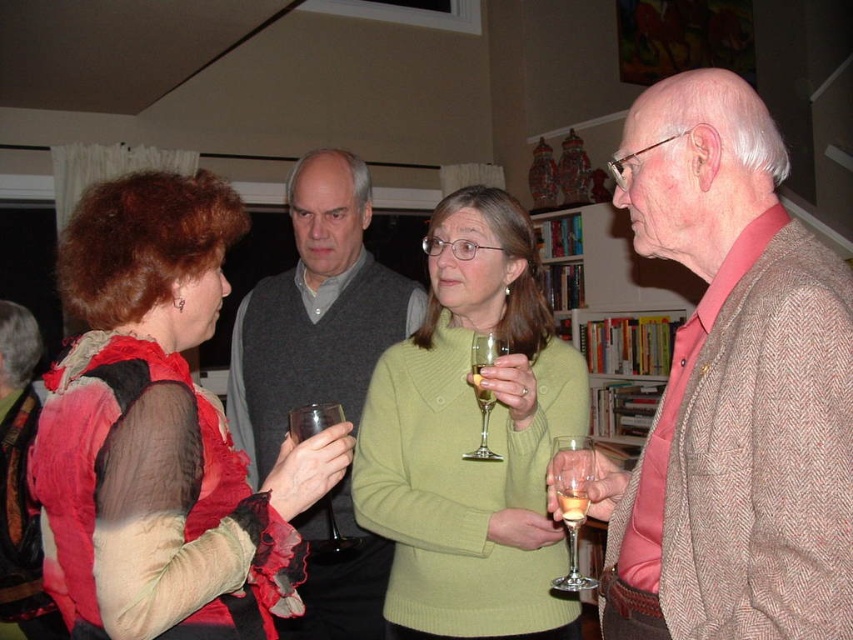
Question: Is dark gray sweater at center bigger than translucent glass wine at center?

Choices:
 (A) yes
 (B) no

Answer: (A)

Question: Which object is closer to the camera taking this photo?

Choices:
 (A) brown herringbone blazer at center
 (B) clear glass wine glass at lower right
 (C) clear glass wine glass at center
 (D) translucent glass wine at center

Answer: (A)

Question: Which object appears closest to the camera in this image?

Choices:
 (A) wooden bookshelf at center
 (B) translucent glass wine at center
 (C) translucent glass at center

Answer: (C)

Question: Can you confirm if wooden bookshelf at center is bigger than clear glass wine glass at lower right?

Choices:
 (A) no
 (B) yes

Answer: (B)

Question: Is matte red blouse at left thinner than dark gray sweater at center?

Choices:
 (A) yes
 (B) no

Answer: (A)

Question: Which point is closer to the camera taking this photo?

Choices:
 (A) (573, 528)
 (B) (490, 364)

Answer: (A)